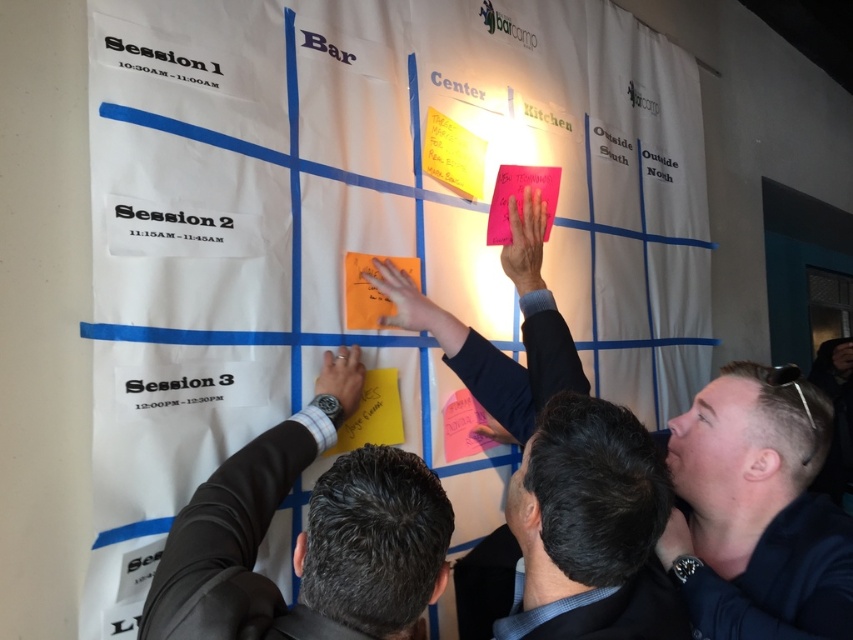
Question: Considering the relative positions of sunglasses at upper right and dark brown hair at center in the image provided, where is sunglasses at upper right located with respect to dark brown hair at center?

Choices:
 (A) left
 (B) right

Answer: (B)

Question: Which point is closer to the camera?

Choices:
 (A) sunglasses at upper right
 (B) pink matte sticky note at upper right
 (C) yellow paper at center
 (D) white paper at center

Answer: (A)

Question: Where is dark brown hair at center located in relation to pink matte sticky note at upper right in the image?

Choices:
 (A) left
 (B) right

Answer: (B)

Question: Does matte black watch at lower left have a lesser width compared to orange matte sticky note at center?

Choices:
 (A) no
 (B) yes

Answer: (A)

Question: Which object is the farthest from the dark brown hair at center?

Choices:
 (A) white paper at center
 (B) yellow paper at center
 (C) sunglasses at upper right
 (D) matte black watch at lower left

Answer: (A)

Question: Which object appears closest to the camera in this image?

Choices:
 (A) matte black watch at lower left
 (B) sunglasses at upper right

Answer: (A)